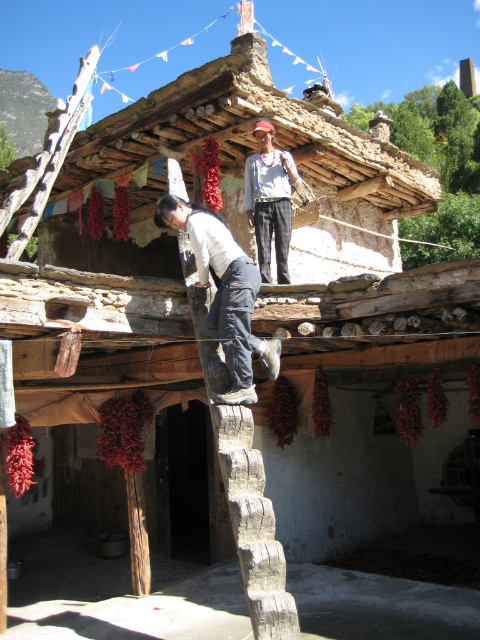
Question: Which of the following is the closest to the observer?

Choices:
 (A) black matte pants at center
 (B) rustic wooden roof at upper center
 (C) white cotton shirt at upper center

Answer: (A)

Question: Is the position of rustic wooden roof at upper center more distant than that of black matte pants at center?

Choices:
 (A) yes
 (B) no

Answer: (A)

Question: Which is nearer to the rustic wooden roof at upper center?

Choices:
 (A) black matte pants at center
 (B) white cotton shirt at upper center

Answer: (B)

Question: Does rustic wooden roof at upper center lie behind white cotton shirt at upper center?

Choices:
 (A) yes
 (B) no

Answer: (B)

Question: Among these objects, which one is nearest to the camera?

Choices:
 (A) black matte pants at center
 (B) white cotton shirt at upper center
 (C) rustic wooden roof at upper center

Answer: (A)

Question: Does black matte pants at center appear on the right side of white cotton shirt at upper center?

Choices:
 (A) no
 (B) yes

Answer: (A)